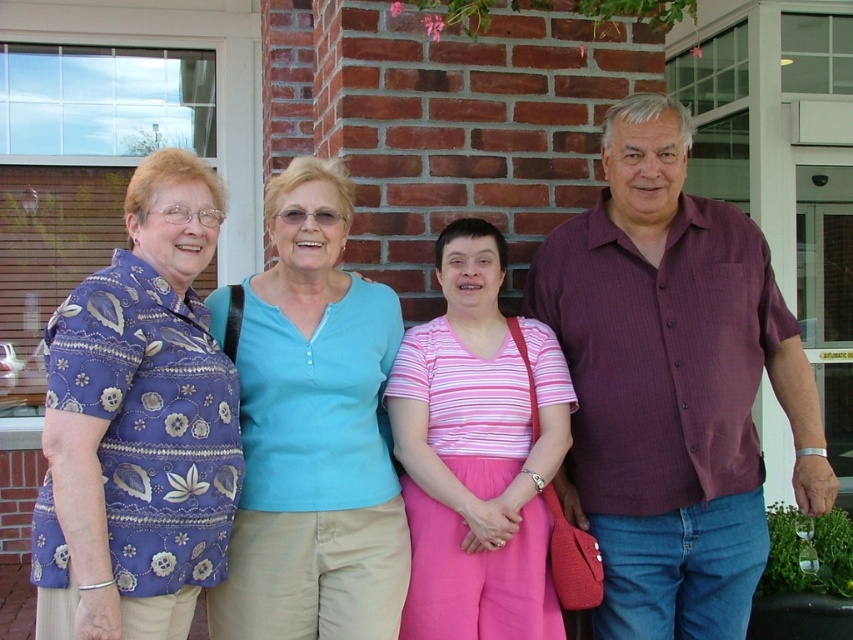
You are a photographer trying to capture a group photo of the purple floral shirt at left and the light blue cotton shirt at center. Since you want to ensure both are fully visible in the photo, which person should be positioned closer to the camera?

The purple floral shirt at left should be positioned closer to the camera because it is already in front of the light blue cotton shirt at center, so keeping it in front will ensure both are visible.

You are standing in front of the brick building and see the group of four people. There is a point marked at coordinates (x=138, y=426). Which person is closest to this point? Please answer with the exact clothing description from the scene description.

The point at coordinates (x=138, y=426) corresponds to the purple floral shirt at left, so the person closest to this point is the woman wearing a purple shirt with a floral pattern.